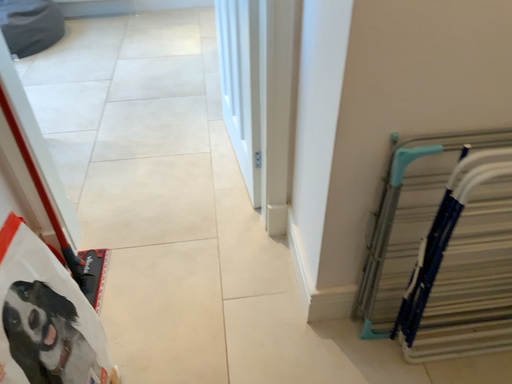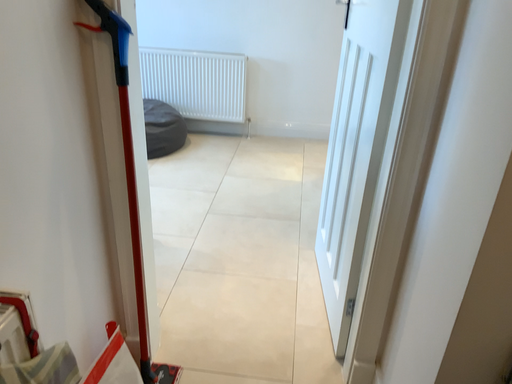
Question: How did the camera likely rotate when shooting the video?

Choices:
 (A) rotated downward
 (B) rotated upward

Answer: (B)